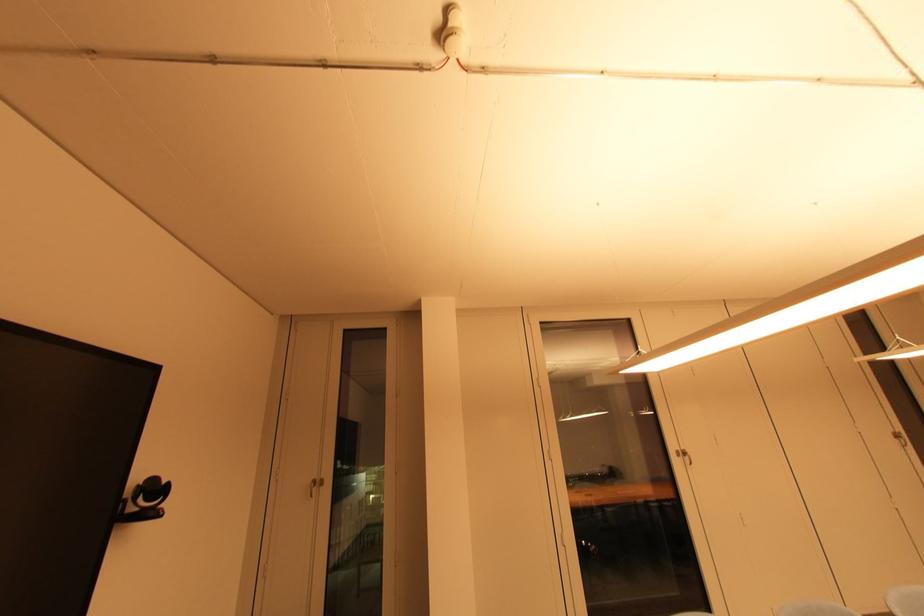
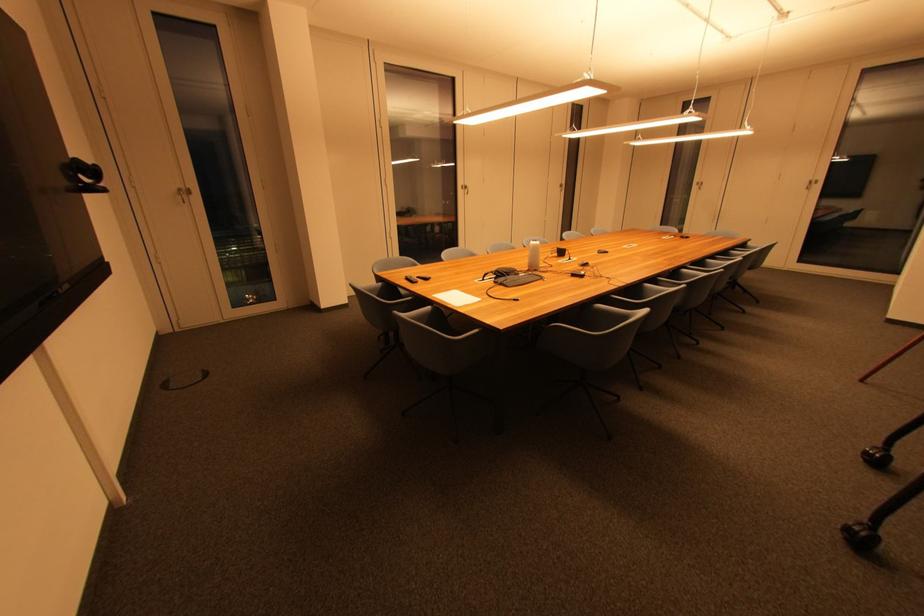
Where in the second image is the point corresponding to [320,484] from the first image?

(185, 192)